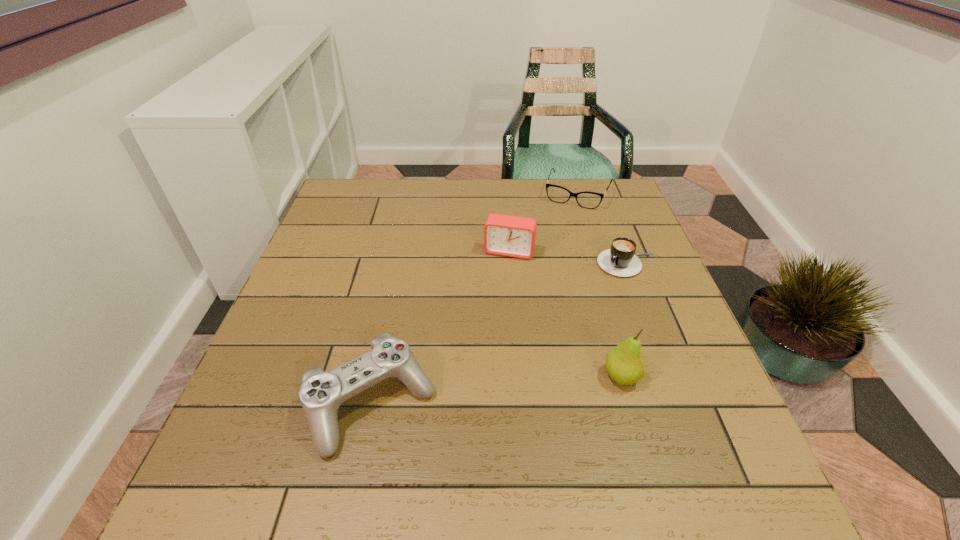
The image size is (960, 540). I want to click on vacant space located 0.310m on the front-facing side of the second object from left to right, so click(x=477, y=355).

At what (x,y) coordinates should I click in order to perform the action: click on vacant space located 0.060m on the front-facing side of the farthest object. Please return your answer as a coordinate pair (x, y). The height and width of the screenshot is (540, 960). Looking at the image, I should click on (564, 221).

The height and width of the screenshot is (540, 960). What are the coordinates of `blank space located on the front-facing side of the farthest object` in the screenshot? It's located at (555, 245).

What are the coordinates of `vacant region located 0.180m on the front-facing side of the farthest object` in the screenshot? It's located at (555, 245).

Locate an element on the screen. This screenshot has height=540, width=960. vacant space located 0.130m with the handle on the side of the cappuccino is located at coordinates (585, 303).

I want to click on free space located 0.100m with the handle on the side of the cappuccino, so click(x=591, y=296).

At what (x,y) coordinates should I click in order to perform the action: click on vacant space located with the handle on the side of the cappuccino. Please return your answer as a coordinate pair (x, y). The height and width of the screenshot is (540, 960). Looking at the image, I should click on (566, 323).

At what (x,y) coordinates should I click in order to perform the action: click on object present at the far edge. Please return your answer as a coordinate pair (x, y). The width and height of the screenshot is (960, 540). Looking at the image, I should click on (590, 200).

Identify the location of object present at the near edge. (321, 394).

At what (x,y) coordinates should I click in order to perform the action: click on object that is at the left edge. Please return your answer as a coordinate pair (x, y). Looking at the image, I should click on (321, 394).